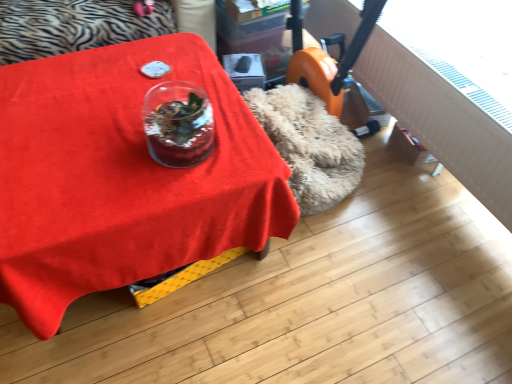
Find the location of a particular element. vacant space to the right of transparent glass vase at center is located at coordinates (241, 148).